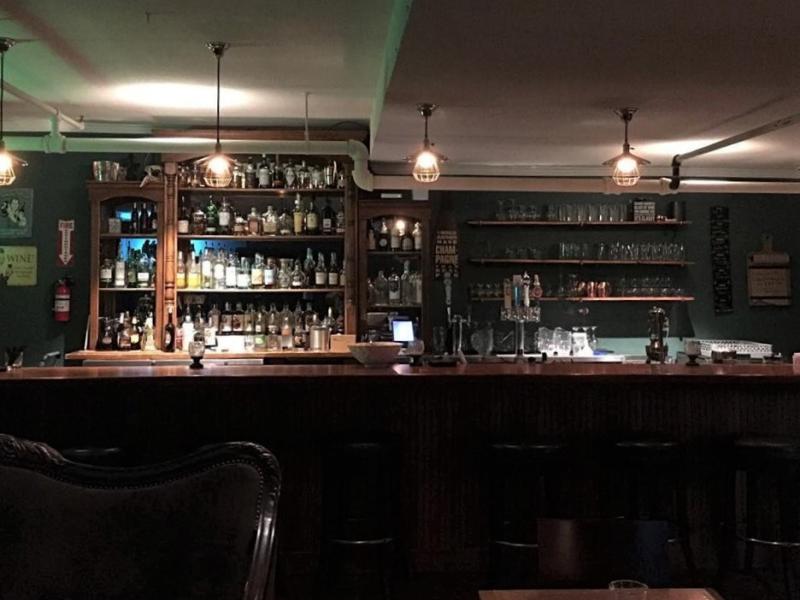
Image resolution: width=800 pixels, height=600 pixels. What are the coordinates of `barstool` in the screenshot? It's located at (642, 481), (518, 492), (380, 461), (104, 458), (770, 458), (284, 530).